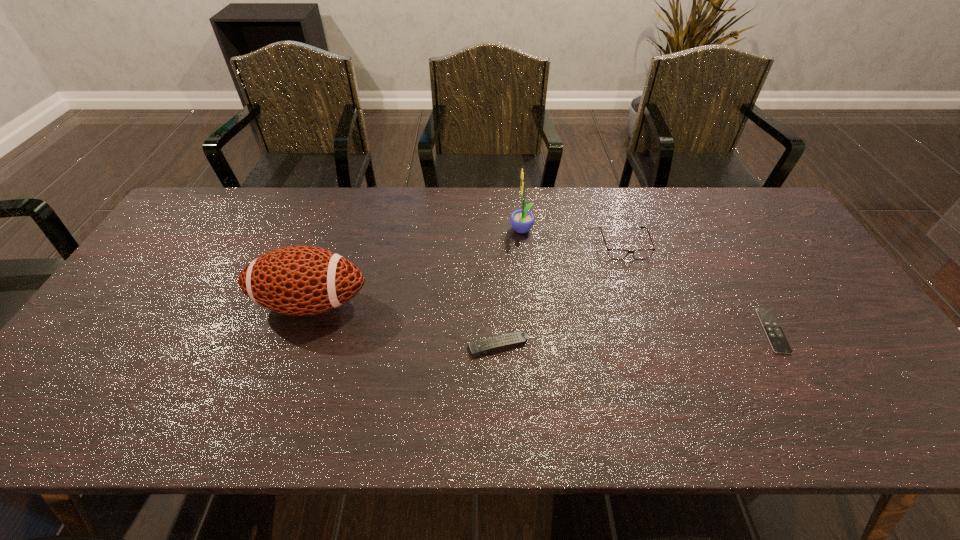
Locate an element on the screen. vacant region located on the front-facing side of the sunflower is located at coordinates (491, 231).

Identify the location of free space located on the front-facing side of the sunflower. The image size is (960, 540). (437, 231).

Image resolution: width=960 pixels, height=540 pixels. In order to click on blank space located 0.290m on the back of the second tallest object in this screenshot , I will do `click(342, 215)`.

I want to click on vacant space situated 0.060m on the lenses of the third shortest object, so coord(634,274).

You are a GUI agent. You are given a task and a screenshot of the screen. Output one action in this format:
    pyautogui.click(x=<x>, y=<y>)
    Task: Click on the vacant space situated 0.080m on the left of the second shortest object
    The width and height of the screenshot is (960, 540).
    Given the screenshot: What is the action you would take?
    pyautogui.click(x=435, y=346)

Where is `blank area located on the front of the shortest object`? This screenshot has width=960, height=540. blank area located on the front of the shortest object is located at coordinates (828, 430).

Where is `sunflower situated at the far edge`? Image resolution: width=960 pixels, height=540 pixels. sunflower situated at the far edge is located at coordinates click(x=522, y=221).

This screenshot has height=540, width=960. I want to click on spectacles present at the far edge, so click(x=618, y=254).

Identify the location of vacant space at the far edge. This screenshot has width=960, height=540. (680, 210).

In the image, there is a desktop. Where is `vacant space at the near edge`? The height and width of the screenshot is (540, 960). vacant space at the near edge is located at coordinates (616, 429).